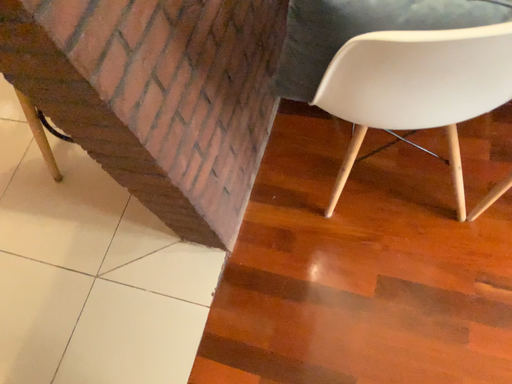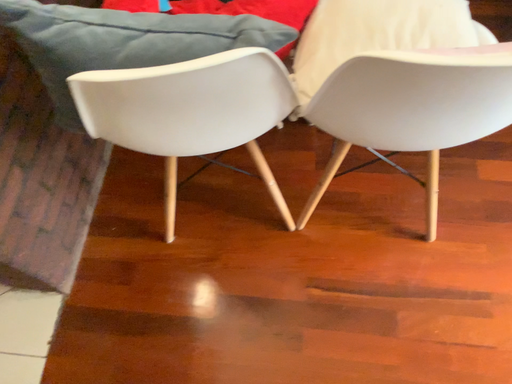
Question: Which way did the camera rotate in the video?

Choices:
 (A) rotated left
 (B) rotated right

Answer: (B)